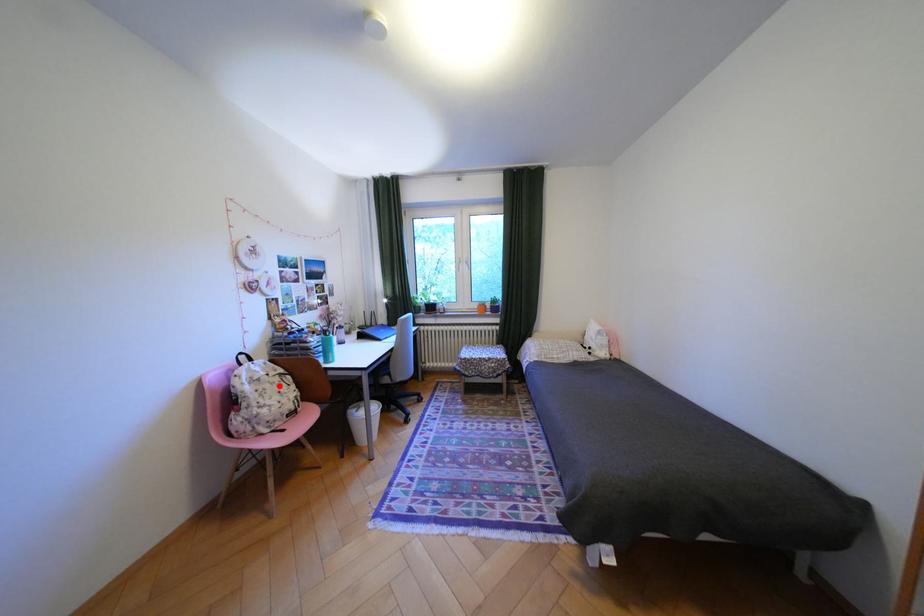
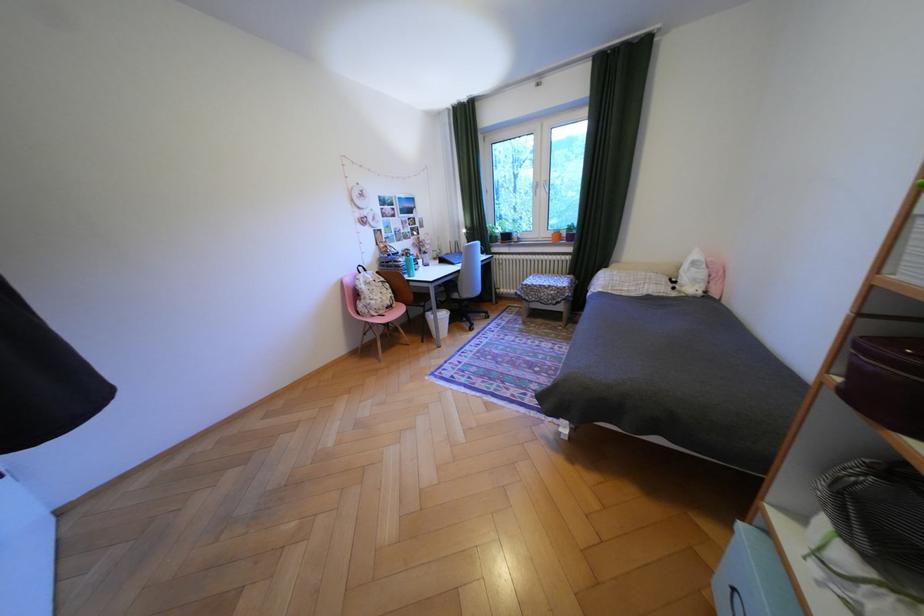
Find the pixel in the second image that matches the highlighted location in the first image.

(386, 288)